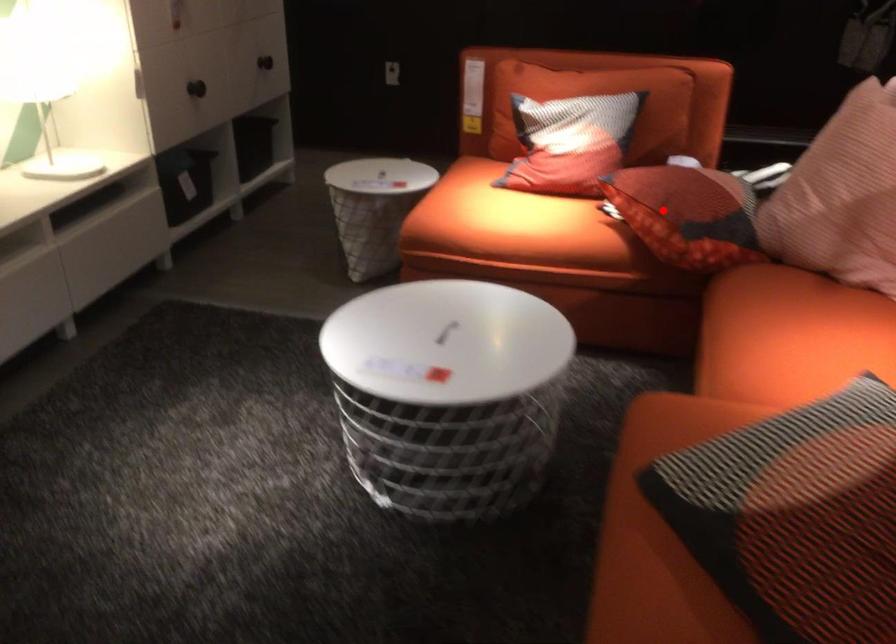
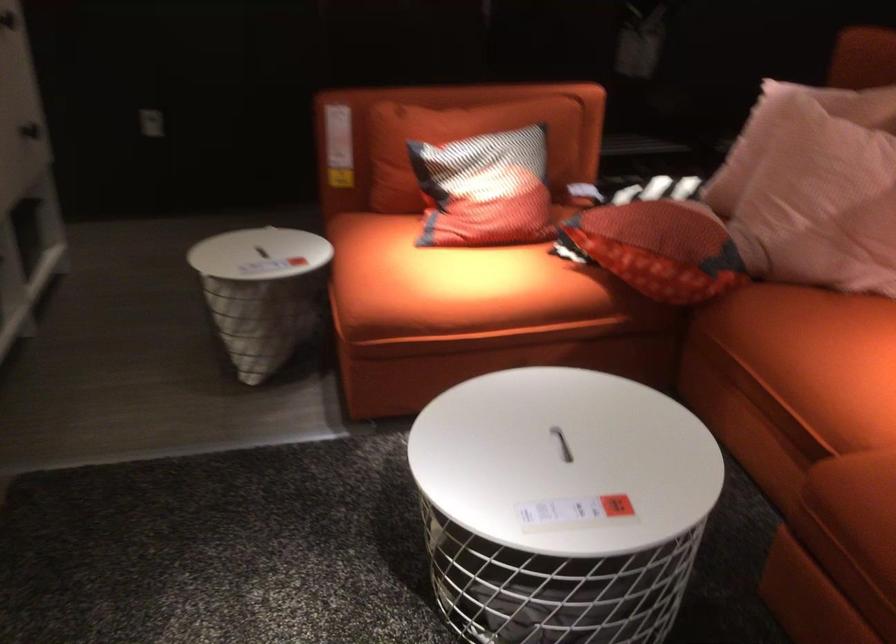
Find the pixel in the second image that matches the highlighted location in the first image.

(659, 248)